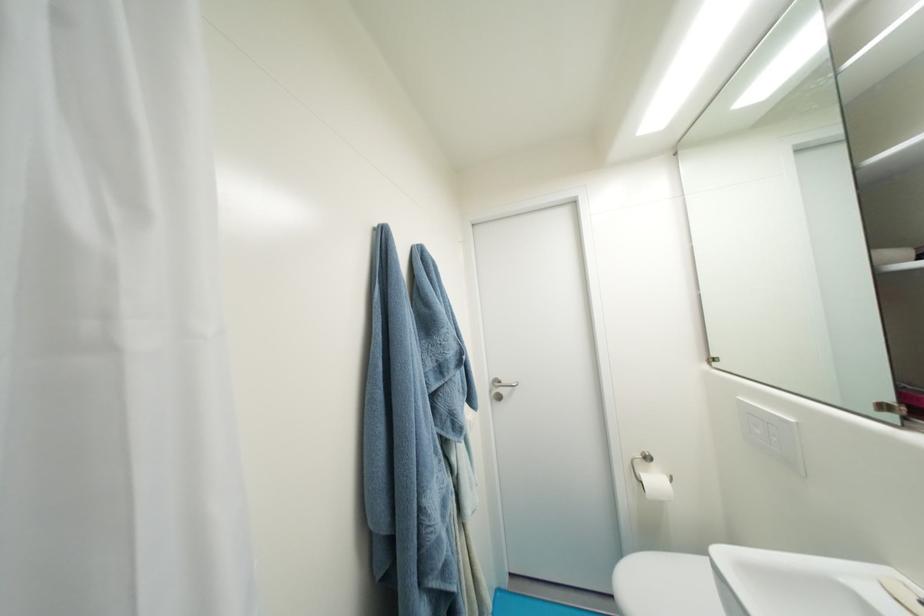
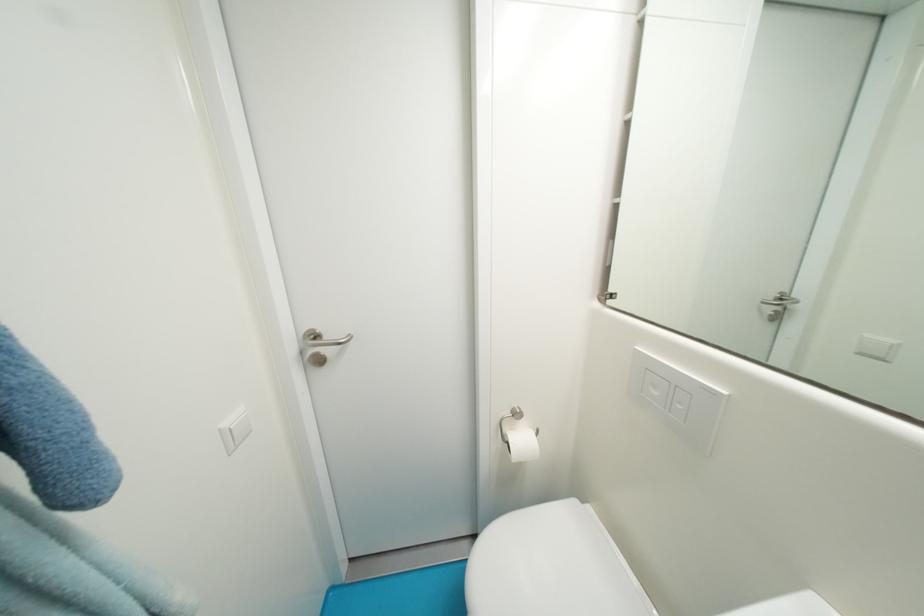
Where in the second image is the point corresponding to (x=764, y=434) from the first image?

(662, 395)